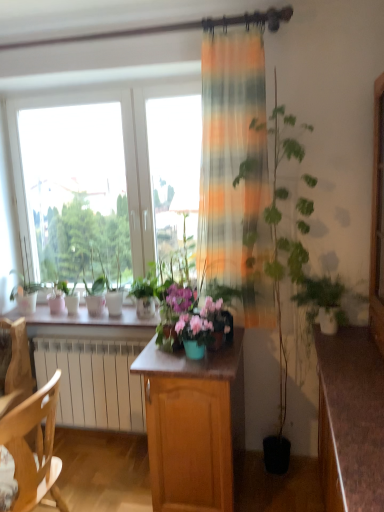
What do you see at coordinates (325, 302) in the screenshot?
I see `green matte plant at right` at bounding box center [325, 302].

Identify the location of white glossy window sill at center. The width and height of the screenshot is (384, 512). (85, 318).

What do you see at coordinates (193, 425) in the screenshot? The width and height of the screenshot is (384, 512). I see `wooden cabinet at center` at bounding box center [193, 425].

The image size is (384, 512). Describe the element at coordinates (35, 446) in the screenshot. I see `wooden chair at lower left` at that location.

Identify the location of green matte plant at right. (325, 302).

Which object is wider, white glossy window sill at center or matte plastic flower box at center?

Wider between the two is white glossy window sill at center.

Is white glossy window sill at center positioned with its back to matte plastic flower box at center?

That's not correct — white glossy window sill at center is not looking away from matte plastic flower box at center.

From the image's perspective, would you say white glossy window sill at center is positioned over matte plastic flower box at center?

Yes, from the image's perspective, white glossy window sill at center is on top of matte plastic flower box at center.

Is white glossy window sill at center surrounding matte plastic flower box at center?

That's incorrect, matte plastic flower box at center is not inside white glossy window sill at center.

Does brown wood desk at lower right have a greater height compared to white glossy window sill at center?

Correct, brown wood desk at lower right is much taller as white glossy window sill at center.

Is there a large distance between brown wood desk at lower right and white glossy window sill at center?

Yes.

Which object is wider, brown wood desk at lower right or white glossy window sill at center?

With larger width is brown wood desk at lower right.

Which point is more forward, [208,405] or [355,439]?

The point [355,439] is closer.

Is wooden cabinet at center turned away from brown wood desk at lower right?

No, wooden cabinet at center is not facing away from brown wood desk at lower right.

Locate an element on the screen. cabinetry behind the brown wood desk at lower right is located at coordinates (193, 425).

Is wooden cabinet at center inside the boundaries of brown wood desk at lower right, or outside?

wooden cabinet at center exists outside the volume of brown wood desk at lower right.

Can you confirm if brown wood desk at lower right is thinner than green matte plant at right?

Incorrect, the width of brown wood desk at lower right is not less than that of green matte plant at right.

Based on the photo, from the image's perspective, does brown wood desk at lower right appear lower than green matte plant at right?

Yes, from the image's perspective, brown wood desk at lower right is beneath green matte plant at right.

Between brown wood desk at lower right and green matte plant at right, which one has smaller size?

With smaller size is green matte plant at right.

Looking at this image, can you tell me how much brown wood desk at lower right and green matte plant at right differ in facing direction?

The angular difference between brown wood desk at lower right and green matte plant at right is 90 degrees.

Between wooden cabinet at center and matte plastic flower box at center, which one has larger size?

wooden cabinet at center.

Are wooden cabinet at center and matte plastic flower box at center far apart?

Actually, wooden cabinet at center and matte plastic flower box at center are a little close together.

Locate an element on the screen. flower box above the wooden cabinet at center (from a real-world perspective) is located at coordinates (194, 334).

From the image's perspective, would you say brown wood desk at lower right is shown under matte plastic flower box at center?

Yes, from the image's perspective, brown wood desk at lower right is below matte plastic flower box at center.

Considering the sizes of objects brown wood desk at lower right and matte plastic flower box at center in the image provided, who is shorter, brown wood desk at lower right or matte plastic flower box at center?

matte plastic flower box at center.

Considering the sizes of brown wood desk at lower right and matte plastic flower box at center in the image, is brown wood desk at lower right bigger or smaller than matte plastic flower box at center?

In the image, brown wood desk at lower right appears to be larger than matte plastic flower box at center.

Consider the image. Would you say matte plastic flower box at center is inside or outside wooden chair at lower left?

matte plastic flower box at center is not inside wooden chair at lower left, it's outside.

Can you confirm if matte plastic flower box at center is taller than wooden chair at lower left?

Incorrect, the height of matte plastic flower box at center is not larger of that of wooden chair at lower left.

Considering the positions of points (177, 328) and (56, 386), is point (177, 328) farther from camera compared to point (56, 386)?

Yes, it is behind point (56, 386).

From a real-world perspective, which is physically above, matte plastic flower box at center or wooden chair at lower left?

matte plastic flower box at center.

You are a GUI agent. You are given a task and a screenshot of the screen. Output one action in this format:
    pyautogui.click(x=<x>, y=<y>)
    Task: Click on the window sill behind the matte plastic flower box at center
    Image resolution: width=384 pixels, height=512 pixels.
    Given the screenshot: What is the action you would take?
    pyautogui.click(x=85, y=318)

You are a GUI agent. You are given a task and a screenshot of the screen. Output one action in this format:
    pyautogui.click(x=<x>, y=<y>)
    Task: Click on the desk that appears below the white glossy window sill at center (from the image's perspective)
    The image size is (384, 512).
    Given the screenshot: What is the action you would take?
    pyautogui.click(x=350, y=420)

Considering their positions, is white glossy window sill at center positioned closer to brown wood desk at lower right than green matte plant at right?

green matte plant at right lies closer to brown wood desk at lower right than the other object.

Estimate the real-world distances between objects in this image. Which object is closer to white glossy window sill at center, matte plastic flower box at center or wooden chair at lower left?

matte plastic flower box at center lies closer to white glossy window sill at center than the other object.

Which object lies nearer to the anchor point white glossy window sill at center, matte plastic flower box at center or wooden cabinet at center?

wooden cabinet at center lies closer to white glossy window sill at center than the other object.

When comparing their distances from wooden chair at lower left, does green matte plant at right or white glossy window sill at center seem further?

green matte plant at right is positioned further to the anchor wooden chair at lower left.

From the image, which object appears to be nearer to wooden cabinet at center, green matte plant at right or matte plastic flower box at center?

Among the two, matte plastic flower box at center is located nearer to wooden cabinet at center.

Estimate the real-world distances between objects in this image. Which object is further from white glossy window sill at center, wooden chair at lower left or matte plastic flower box at center?

The object further to white glossy window sill at center is wooden chair at lower left.

Looking at this image, when comparing their distances from green matte plant at right, does wooden cabinet at center or matte plastic flower box at center seem further?

wooden cabinet at center is further to green matte plant at right.

Consider the image. Based on their spatial positions, is brown wood desk at lower right or wooden chair at lower left further from white glossy window sill at center?

Based on the image, brown wood desk at lower right appears to be further to white glossy window sill at center.

Locate an element on the screen. The height and width of the screenshot is (512, 384). cabinetry located between wooden chair at lower left and green matte plant at right in the left-right direction is located at coordinates (193, 425).

Image resolution: width=384 pixels, height=512 pixels. What are the coordinates of `houseplant located between wooden chair at lower left and brown wood desk at lower right in the left-right direction` in the screenshot? It's located at (325, 302).

Find the location of a particular element. This screenshot has height=512, width=384. cabinetry between white glossy window sill at center and green matte plant at right from left to right is located at coordinates (193, 425).

At what (x,y) coordinates should I click in order to perform the action: click on window sill located between wooden chair at lower left and brown wood desk at lower right in the left-right direction. Please return your answer as a coordinate pair (x, y). Looking at the image, I should click on (85, 318).